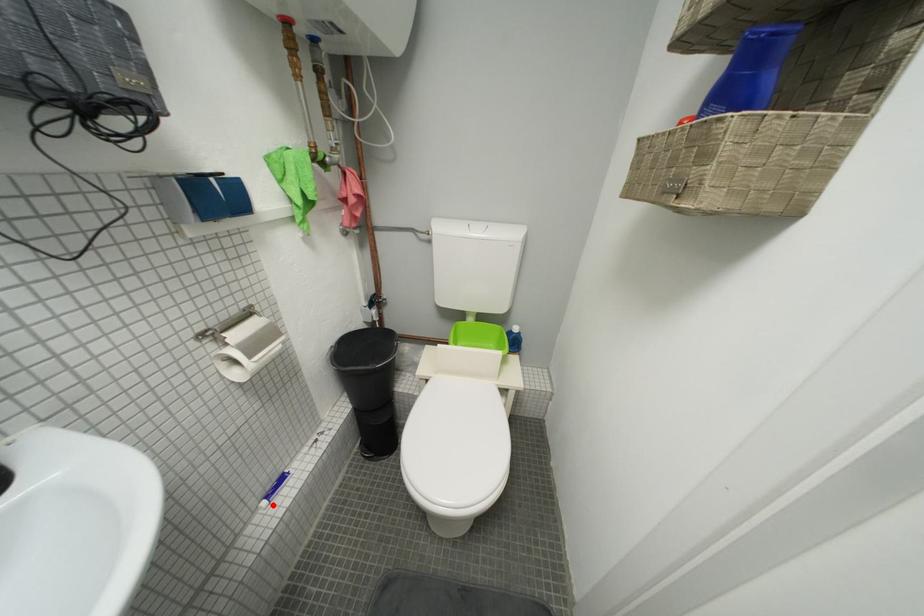
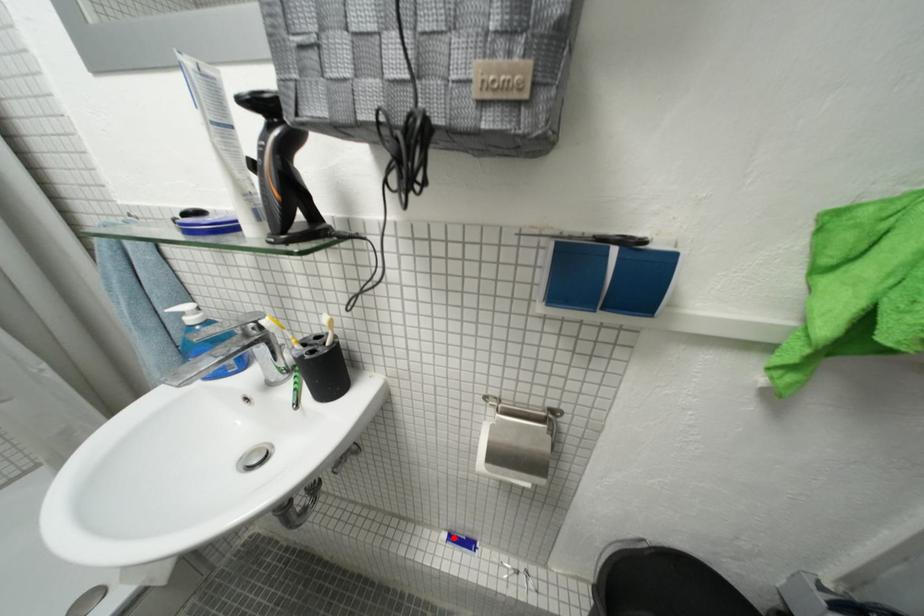
I am providing you with two images of the same scene from different viewpoints. A red point is marked on the first image and another point is marked on the second image. Is the red point in image1 aligned with the point shown in image2?

Yes